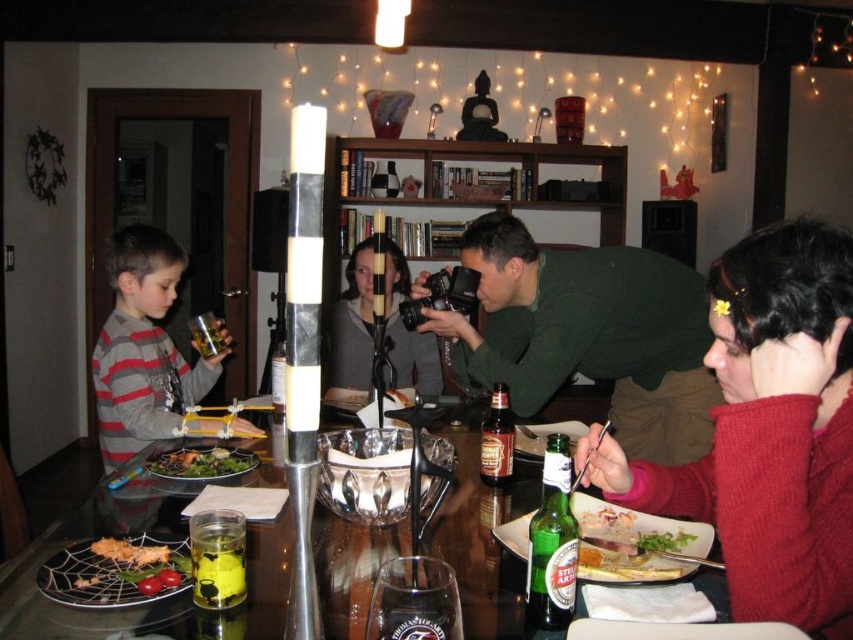
Consider the image. You are a guest at this dinner and want to reach the green leafy salad at lower right without touching the green matte shirt at center. Is this possible?

The green matte shirt at center is located above the green leafy salad at lower right, so you can reach the salad by moving around the table or under the shirt if it is hanging loosely, but you must be careful not to touch the shirt.

You are a guest at this dinner and want to grab the tallest item on the table. Which one should you choose between the green glass bottle at lower right and the green leafy salad at center?

The green glass bottle at lower right is taller than the green leafy salad at center, so you should choose the green glass bottle at lower right.